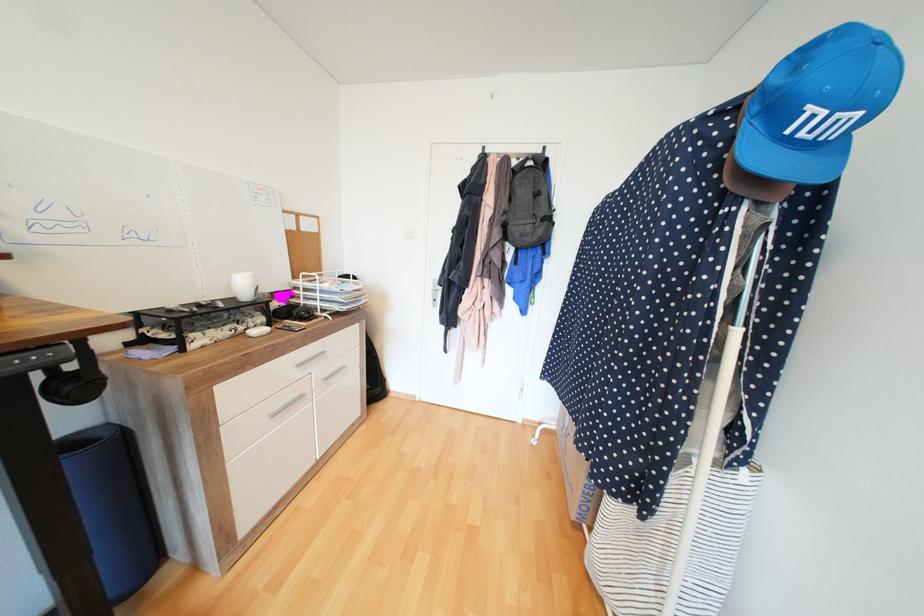
Where would you lift the grey backpack? Please return your answer as a coordinate pair (x, y).

(529, 204)